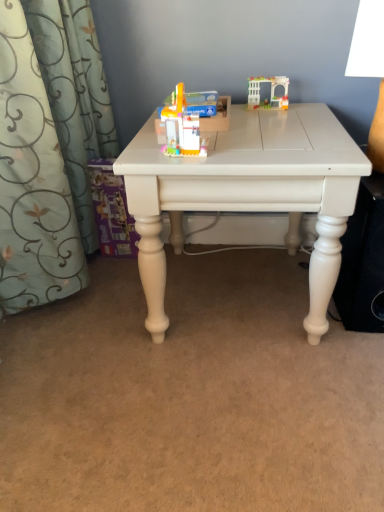
Locate an element on the screen. free space that is to the left of translucent plastic toy at center, which appears as the 1th toy when ordered from the bottom is located at coordinates (142, 151).